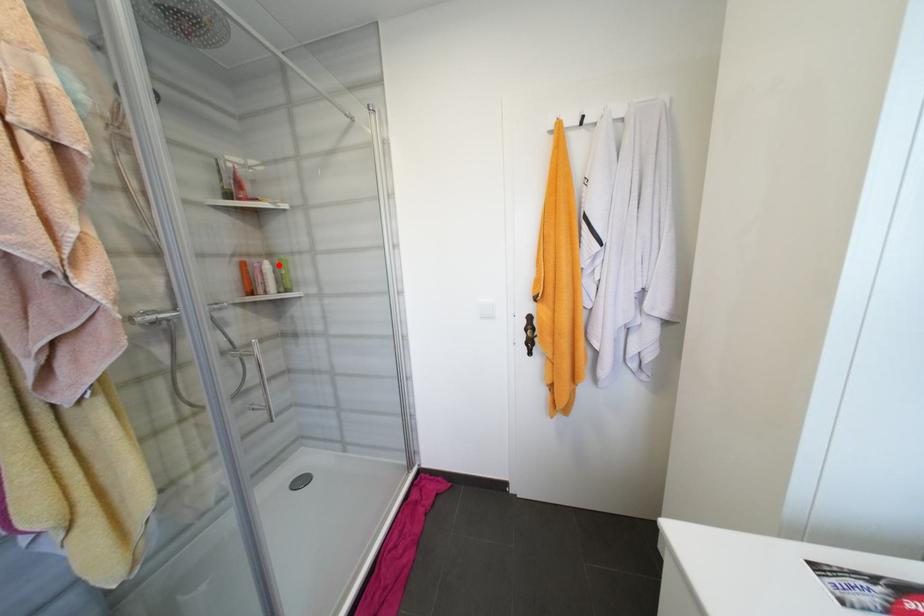
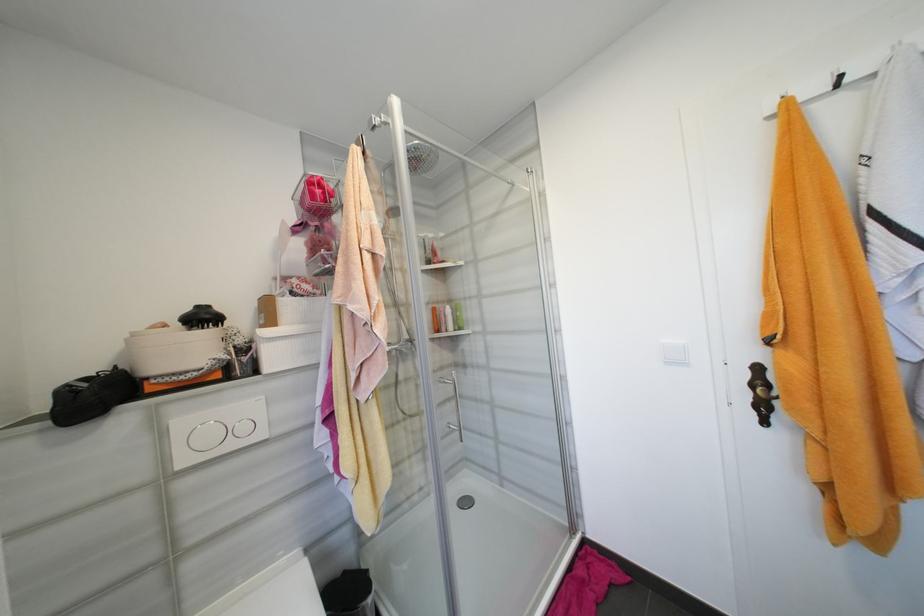
The point at the highlighted location is marked in the first image. Where is the corresponding point in the second image?

(457, 309)